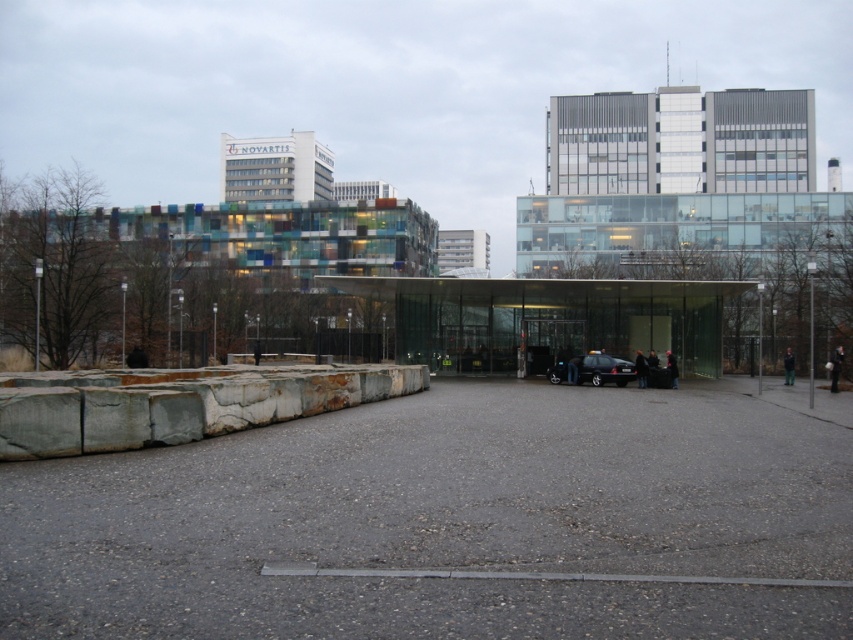
Looking at this image, is the position of gray asphalt parking lot at center more distant than that of black metallic car at center?

No.

How far apart are gray asphalt parking lot at center and black metallic car at center?

63.18 feet

What do you see at coordinates (450, 520) in the screenshot? This screenshot has width=853, height=640. I see `gray asphalt parking lot at center` at bounding box center [450, 520].

What are the coordinates of `gray asphalt parking lot at center` in the screenshot? It's located at (450, 520).